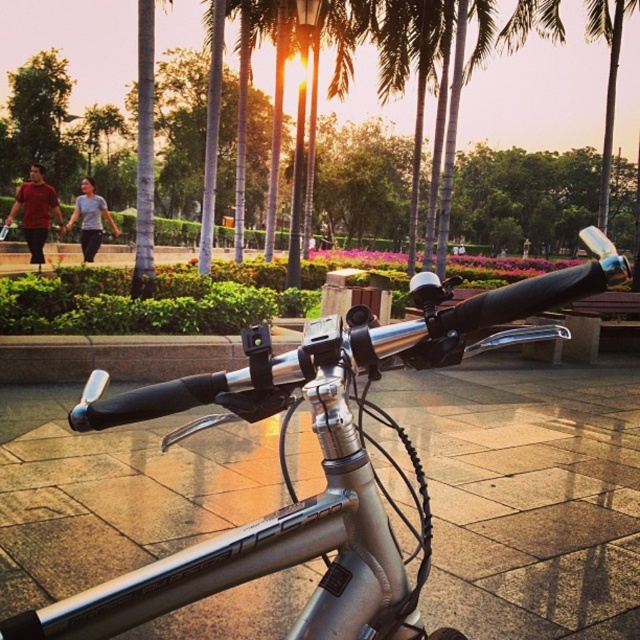
You are standing in the park and see the silver metallic bicycle handlebars at center and the matte red shirt at left. Which object is positioned lower from the ground?

The silver metallic bicycle handlebars at center is below matte red shirt at left, so the silver metallic bicycle handlebars at center is positioned lower from the ground.

You are an observer standing in the park and see the matte red shirt at left and the light blue cotton shirt at center. Which shirt appears narrower?

The matte red shirt at left appears narrower than the light blue cotton shirt at center because it has a lesser width.

You are a fashion designer observing two shirts in a park scene. The scene has a silver bicycle in the foreground and palm trees in the background. Which of the two shirts, the matte red shirt at left or the light blue cotton shirt at center, is shorter in length?

The matte red shirt at left is shorter than the light blue cotton shirt at center.